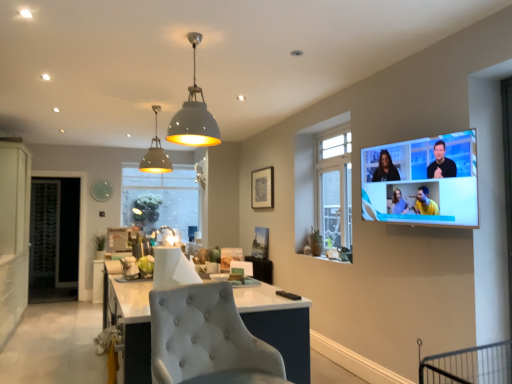
Question: Is clear glass window at center, which ranks as the first window in back-to-front order, taller or shorter than white matte cabinet at left?

Choices:
 (A) short
 (B) tall

Answer: (A)

Question: From the image's perspective, is clear glass window at center, the second window from the right, above or below white matte cabinet at left?

Choices:
 (A) above
 (B) below

Answer: (A)

Question: Which is farther from the clear glass window at center, the second window from the right?

Choices:
 (A) clear glass window at center, the second window positioned from the left
 (B) white tufted chair at center
 (C) matte white dome at upper center
 (D) flat screen tv at upper right
 (E) clear glass door at left

Answer: (B)

Question: Based on their relative distances, which object is nearer to the clear glass window at center, which is the 2th window from front to back?

Choices:
 (A) white matte cabinet at left
 (B) flat screen tv at upper right
 (C) matte black picture frame at upper center
 (D) clear glass window at center, which is counted as the 1th window, starting from the right
 (E) matte white dome at upper center

Answer: (C)